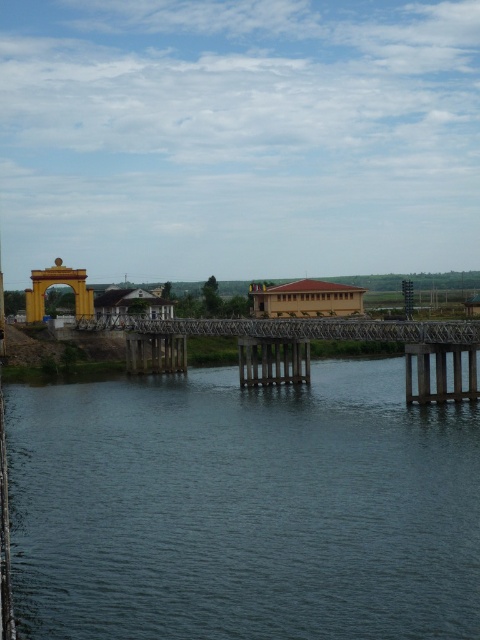
In the scene shown: You are a photographer standing at the riverside and want to capture both the metallic bridge at center and the gold metallic archway at left in your shot. Which object should you focus on first to ensure both are in frame?

You should focus on the metallic bridge at center first since it is closer to you than the gold metallic archway at left, ensuring both are in frame by adjusting the camera angle accordingly.

You are a tourist standing at the riverside and want to take a photo that includes both the metallic bridge at center and the gold metallic archway at left. Based on their sizes, which object should you position closer to the center of your photo to ensure both fit in the frame?

Since the metallic bridge at center is larger than the gold metallic archway at left, you should position the metallic bridge at center closer to the center of your photo to ensure both fit in the frame.

You are standing at the yellow archway structure on the left side of the riverside scene. You notice two points marked in the image. Which point, point [443,390] or point [34,282], is closer to you?

Point [443,390] is closer to the viewer than point [34,282].